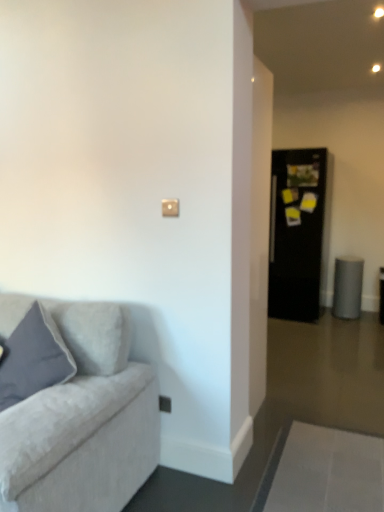
What do you see at coordinates (165, 404) in the screenshot? I see `satin silver outlet at lower center` at bounding box center [165, 404].

Find the location of `satin silver outlet at lower center`. satin silver outlet at lower center is located at coordinates (165, 404).

Measure the distance between matte gray pillow at left and camera.

matte gray pillow at left and camera are 5.99 feet apart from each other.

In order to click on matte beige switch at upper center in this screenshot , I will do `click(170, 207)`.

Is black glossy refrigerator at right wider or thinner than satin silver outlet at lower center?

Clearly, black glossy refrigerator at right has more width compared to satin silver outlet at lower center.

What's the angular difference between black glossy refrigerator at right and satin silver outlet at lower center's facing directions?

They differ by 0.603 degrees in their facing directions.

Is point (323, 269) positioned in front of point (161, 410)?

No.

Considering the sizes of objects black glossy refrigerator at right and satin silver outlet at lower center in the image provided, who is taller, black glossy refrigerator at right or satin silver outlet at lower center?

black glossy refrigerator at right.

Between matte beige switch at upper center and black glossy refrigerator at right, which one has less height?

matte beige switch at upper center is shorter.

Is matte beige switch at upper center facing away from black glossy refrigerator at right?

Yes, matte beige switch at upper center is positioned with its back facing black glossy refrigerator at right.

Is point (166, 208) closer or farther from the camera than point (283, 150)?

Clearly, point (166, 208) is closer to the camera than point (283, 150).

Does point (292, 266) lie in front of point (163, 204)?

No, it is behind (163, 204).

Is black glossy refrigerator at right oriented away from matte beige switch at upper center?

No, black glossy refrigerator at right is not facing the opposite direction of matte beige switch at upper center.

Between black glossy refrigerator at right and matte beige switch at upper center, which one has less height?

With less height is matte beige switch at upper center.

Do you think black glossy refrigerator at right is within matte beige switch at upper center, or outside of it?

black glossy refrigerator at right lies outside matte beige switch at upper center.

Is satin silver outlet at lower center wider than matte beige switch at upper center?

Yes.

In the scene shown: How far apart are satin silver outlet at lower center and matte beige switch at upper center?

They are 38.14 inches apart.

Can you confirm if satin silver outlet at lower center is positioned to the left of matte beige switch at upper center?

Indeed, satin silver outlet at lower center is positioned on the left side of matte beige switch at upper center.

Between point (164, 407) and point (164, 216), which one is positioned in front?

The point (164, 216) is closer.

Is the position of satin silver outlet at lower center more distant than that of matte gray pillow at left?

Yes, satin silver outlet at lower center is behind matte gray pillow at left.

Would you say satin silver outlet at lower center contains matte gray pillow at left?

No, matte gray pillow at left is not surrounded by satin silver outlet at lower center.

Between point (169, 406) and point (18, 392), which one is positioned in front?

Positioned in front is point (18, 392).

Between satin silver outlet at lower center and matte gray pillow at left, which one has smaller width?

Thinner between the two is satin silver outlet at lower center.

Which is behind, matte gray pillow at left or black glossy refrigerator at right?

black glossy refrigerator at right is more distant.

Image resolution: width=384 pixels, height=512 pixels. What are the coordinates of `glass door that is on the right side of matte gray pillow at left` in the screenshot? It's located at (299, 232).

Between point (48, 332) and point (299, 186), which one is positioned in front?

The point (48, 332) is closer.

What's the angular difference between matte gray pillow at left and black glossy refrigerator at right's facing directions?

matte gray pillow at left and black glossy refrigerator at right are facing 2.65 degrees away from each other.

From a real-world perspective, is satin silver outlet at lower center located beneath black glossy refrigerator at right?

Yes, from a real-world perspective, satin silver outlet at lower center is below black glossy refrigerator at right.

In the scene shown: From the image's perspective, is satin silver outlet at lower center positioned above or below black glossy refrigerator at right?

Based on their image positions, satin silver outlet at lower center is located beneath black glossy refrigerator at right.

Measure the distance between satin silver outlet at lower center and black glossy refrigerator at right.

satin silver outlet at lower center and black glossy refrigerator at right are 8.98 feet apart from each other.

Is the surface of satin silver outlet at lower center in direct contact with black glossy refrigerator at right?

No, satin silver outlet at lower center is not touching black glossy refrigerator at right.

Image resolution: width=384 pixels, height=512 pixels. Identify the location of glass door that appears behind the satin silver outlet at lower center. (299, 232).

Locate an element on the screen. This screenshot has height=512, width=384. glass door located above the matte beige switch at upper center (from the image's perspective) is located at coordinates (299, 232).

Looking at the image, which one is located closer to matte beige switch at upper center, matte gray pillow at left or black glossy refrigerator at right?

matte gray pillow at left is positioned closer to the anchor matte beige switch at upper center.

Estimate the real-world distances between objects in this image. Which object is further from matte beige switch at upper center, satin silver outlet at lower center or matte gray pillow at left?

The object further to matte beige switch at upper center is satin silver outlet at lower center.

Estimate the real-world distances between objects in this image. Which object is closer to matte beige switch at upper center, matte gray pillow at left or satin silver outlet at lower center?

Based on the image, matte gray pillow at left appears to be nearer to matte beige switch at upper center.

Looking at the image, which one is located further to black glossy refrigerator at right, matte beige switch at upper center or matte gray pillow at left?

matte gray pillow at left is further to black glossy refrigerator at right.

Looking at the image, which one is located further to matte gray pillow at left, satin silver outlet at lower center or matte beige switch at upper center?

matte beige switch at upper center lies further to matte gray pillow at left than the other object.

Looking at the image, which one is located closer to satin silver outlet at lower center, black glossy refrigerator at right or matte beige switch at upper center?

The object closer to satin silver outlet at lower center is matte beige switch at upper center.

Considering their positions, is matte beige switch at upper center positioned closer to matte gray pillow at left than satin silver outlet at lower center?

Among the two, satin silver outlet at lower center is located nearer to matte gray pillow at left.

When comparing their distances from black glossy refrigerator at right, does matte gray pillow at left or satin silver outlet at lower center seem closer?

satin silver outlet at lower center.

Locate an element on the screen. The image size is (384, 512). electric outlet between matte gray pillow at left and black glossy refrigerator at right in the front-back direction is located at coordinates (165, 404).

The height and width of the screenshot is (512, 384). Identify the location of electric outlet between matte beige switch at upper center and black glossy refrigerator at right in the front-back direction. (165, 404).

Locate an element on the screen. pillow between matte beige switch at upper center and satin silver outlet at lower center in the vertical direction is located at coordinates (33, 358).

Image resolution: width=384 pixels, height=512 pixels. Find the location of `light switch located between matte gray pillow at left and black glossy refrigerator at right in the depth direction`. light switch located between matte gray pillow at left and black glossy refrigerator at right in the depth direction is located at coordinates (170, 207).